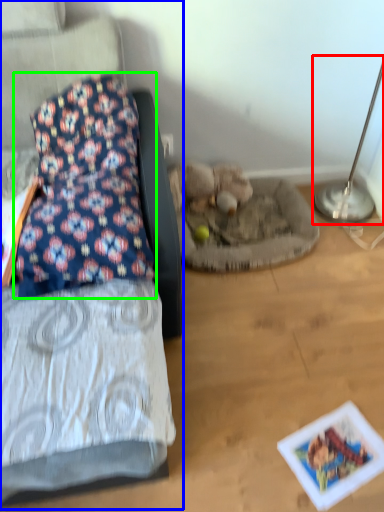
Question: Considering the real-world distances, which object is closest to table lamp (highlighted by a red box)? furniture (highlighted by a blue box) or pillow (highlighted by a green box).

Choices:
 (A) furniture
 (B) pillow

Answer: (A)